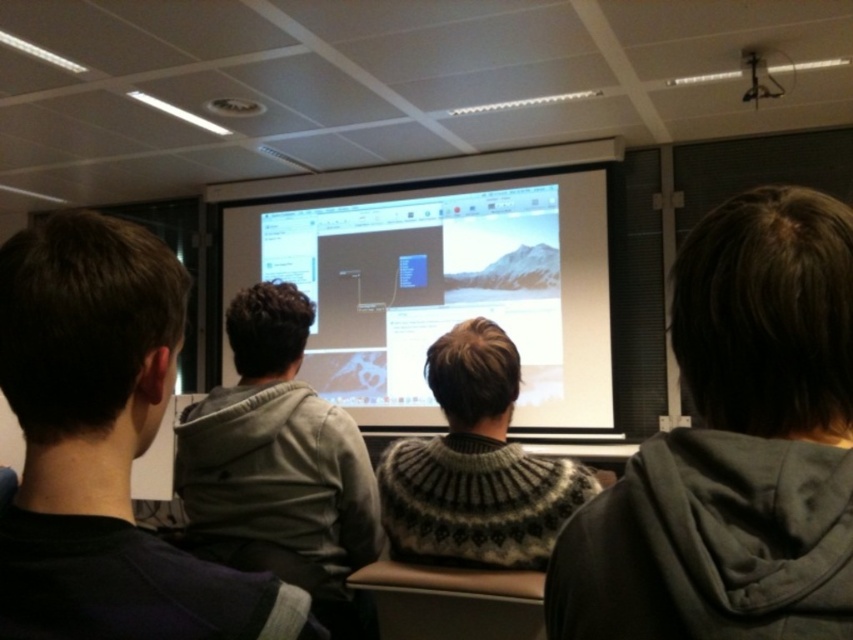
You are a student sitting in the classroom and want to look at the white glossy projection screen at center and the knitted sweater at center. Since both are in the center, how far apart are they from each other?

The white glossy projection screen at center and knitted sweater at center are 11.27 feet apart from each other.

You are a student sitting in the classroom and want to take a photo of the white glossy projection screen at center. However, there is a dark gray hoodie at left blocking your view. Can you adjust your position to avoid the hoodie and still see the screen?

The dark gray hoodie at left is positioned under the white glossy projection screen at center, so moving your position upwards or to the side should allow you to see the screen without obstruction from the hoodie.